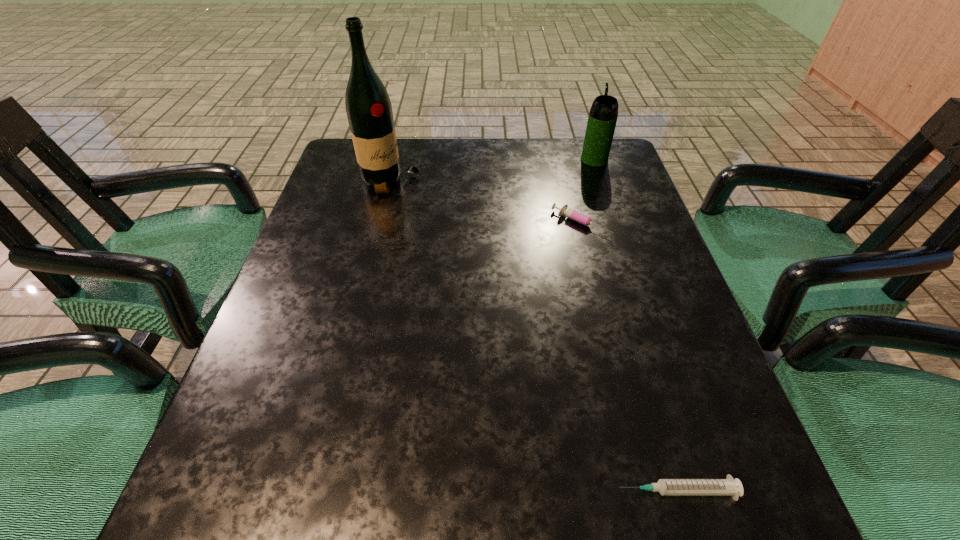
Locate an element on the screen. Image resolution: width=960 pixels, height=540 pixels. the leftmost object is located at coordinates (369, 111).

This screenshot has height=540, width=960. I want to click on the tallest object, so [x=369, y=111].

Find the location of `the second tallest object`. the second tallest object is located at coordinates (603, 114).

Identify the location of the second nearest object. The width and height of the screenshot is (960, 540). (565, 211).

At what (x,y) coordinates should I click in order to perform the action: click on the nearer syringe. Please return your answer as a coordinate pair (x, y). This screenshot has height=540, width=960. Looking at the image, I should click on (666, 487).

Where is `vacant space located 0.190m on the right of the tallest object`? This screenshot has height=540, width=960. vacant space located 0.190m on the right of the tallest object is located at coordinates (492, 181).

This screenshot has width=960, height=540. I want to click on free space located from the spout of the thermos bottle, so click(588, 139).

Where is `free space located 0.080m on the right of the farther syringe`? free space located 0.080m on the right of the farther syringe is located at coordinates (642, 223).

Where is `vacant space located at the needle end of the nearer syringe`? This screenshot has height=540, width=960. vacant space located at the needle end of the nearer syringe is located at coordinates (426, 490).

Locate an element on the screen. This screenshot has height=540, width=960. free spot located at the needle end of the nearer syringe is located at coordinates (369, 490).